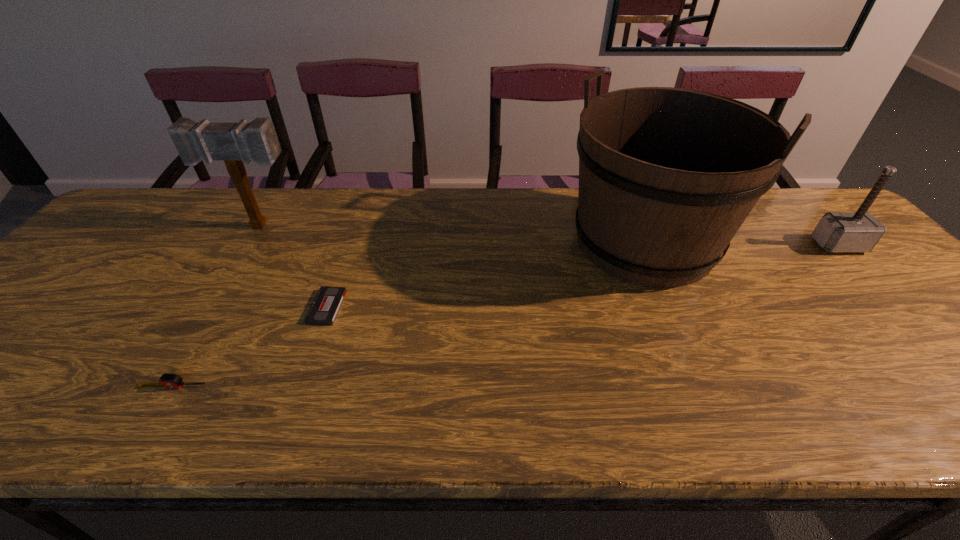
In order to click on free space located 0.300m on the front of the fourth shortest object in this screenshot , I will do `click(210, 310)`.

The height and width of the screenshot is (540, 960). What are the coordinates of `vacant space situated 0.060m for striking with the head of the rightmost object` in the screenshot? It's located at (862, 271).

Where is `vacant point located 0.150m on the right of the tape measure`? The image size is (960, 540). vacant point located 0.150m on the right of the tape measure is located at coordinates coord(280,387).

Locate an element on the screen. The image size is (960, 540). free location located 0.110m on the front of the videotape is located at coordinates (307, 366).

Find the location of a particular element. bucket located in the far edge section of the desktop is located at coordinates (667, 176).

Where is `mallet that is at the far edge`? This screenshot has height=540, width=960. mallet that is at the far edge is located at coordinates (232, 142).

The image size is (960, 540). I want to click on object that is positioned at the right edge, so click(x=860, y=231).

Find the location of a particular element. free space at the far edge of the desktop is located at coordinates (225, 203).

Image resolution: width=960 pixels, height=540 pixels. In order to click on free space at the near edge of the desktop in this screenshot , I will do `click(564, 393)`.

What are the coordinates of `unoccupied position between the second tallest object and the videotape` in the screenshot? It's located at (294, 267).